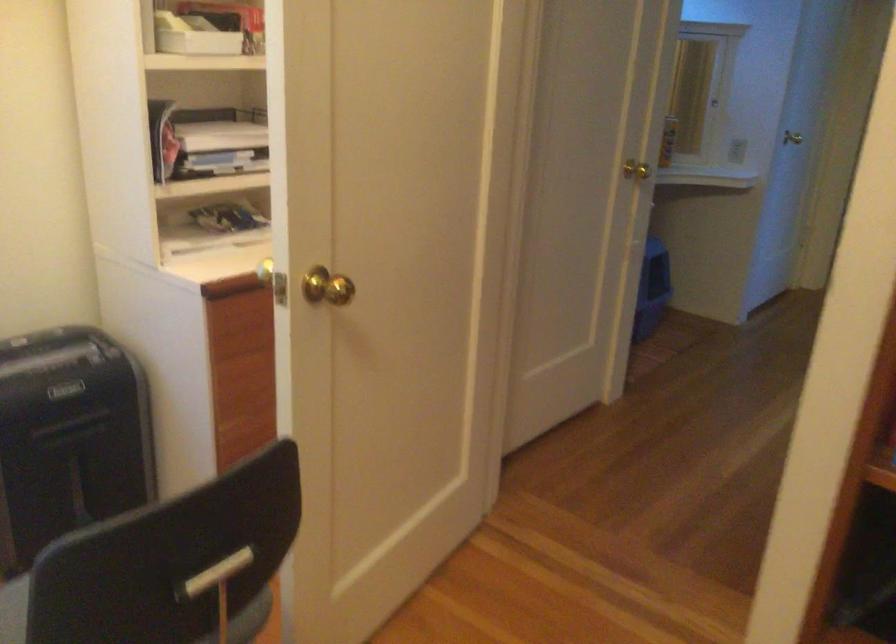
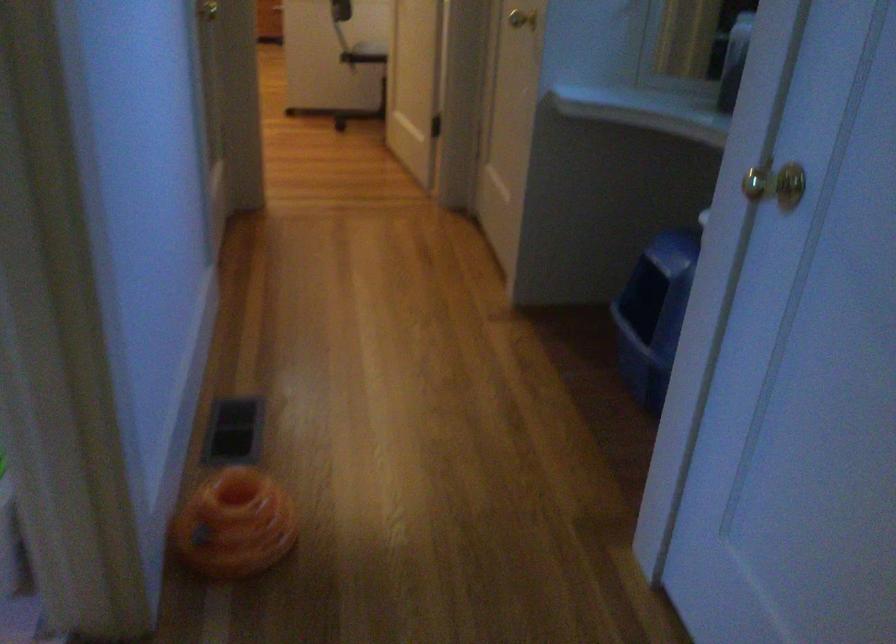
Locate, in the second image, the point that corresponds to point 602,184 in the first image.

(521, 19)